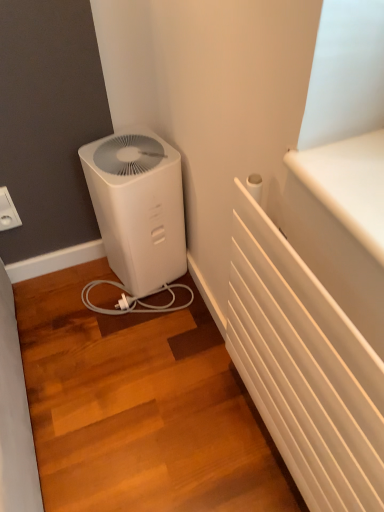
Find the location of a particular element. The height and width of the screenshot is (512, 384). white plastic air purifier at lower left is located at coordinates (138, 207).

What do you see at coordinates (138, 207) in the screenshot?
I see `white plastic air purifier at lower left` at bounding box center [138, 207].

The height and width of the screenshot is (512, 384). What are the coordinates of `white plastic electric outlet at upper left` in the screenshot? It's located at (8, 211).

Looking at this image, in order to face white plastic electric outlet at upper left, should I rotate leftwards or rightwards?

It's best to rotate left around 23.823 degrees.

Describe the element at coordinates (8, 211) in the screenshot. Image resolution: width=384 pixels, height=512 pixels. I see `white plastic electric outlet at upper left` at that location.

Locate an element on the screen. white plastic air purifier at lower left is located at coordinates (138, 207).

From the picture: Does white plastic electric outlet at upper left appear on the left side of white plastic air purifier at lower left?

Indeed, white plastic electric outlet at upper left is positioned on the left side of white plastic air purifier at lower left.

Which is in front, white plastic electric outlet at upper left or white plastic air purifier at lower left?

white plastic air purifier at lower left is closer to the camera.

Is point (11, 199) positioned in front of point (105, 223)?

Yes.

From the image's perspective, who appears lower, white plastic electric outlet at upper left or white plastic air purifier at lower left?

white plastic air purifier at lower left, from the image's perspective.

From a real-world perspective, does white plastic electric outlet at upper left sit lower than white plastic air purifier at lower left?

No, from a real-world perspective, white plastic electric outlet at upper left is not below white plastic air purifier at lower left.

Considering the relative sizes of white plastic electric outlet at upper left and white plastic air purifier at lower left in the image provided, is white plastic electric outlet at upper left wider than white plastic air purifier at lower left?

Incorrect, the width of white plastic electric outlet at upper left does not surpass that of white plastic air purifier at lower left.

Can you confirm if white plastic electric outlet at upper left is taller than white plastic air purifier at lower left?

No.

Between white plastic electric outlet at upper left and white plastic air purifier at lower left, which one has smaller size?

With smaller size is white plastic electric outlet at upper left.

In the scene shown: Is white plastic electric outlet at upper left inside the boundaries of white plastic air purifier at lower left, or outside?

white plastic electric outlet at upper left is outside white plastic air purifier at lower left.

Is white plastic electric outlet at upper left not near white plastic air purifier at lower left?

white plastic electric outlet at upper left is near white plastic air purifier at lower left, not far away.

Is white plastic electric outlet at upper left facing towards white plastic air purifier at lower left?

No, white plastic electric outlet at upper left does not turn towards white plastic air purifier at lower left.

Find the location of a particular element. The image size is (384, 512). home appliance located underneath the white plastic electric outlet at upper left (from a real-world perspective) is located at coordinates (138, 207).

Can you confirm if white plastic air purifier at lower left is positioned to the left of white plastic electric outlet at upper left?

No, white plastic air purifier at lower left is not to the left of white plastic electric outlet at upper left.

Which is behind, white plastic air purifier at lower left or white plastic electric outlet at upper left?

white plastic electric outlet at upper left is behind.

Is point (136, 261) closer to camera compared to point (3, 229)?

That is True.

From the image's perspective, between white plastic air purifier at lower left and white plastic electric outlet at upper left, which one is located above?

white plastic electric outlet at upper left is shown above in the image.

From a real-world perspective, is white plastic air purifier at lower left located higher than white plastic electric outlet at upper left?

No, from a real-world perspective, white plastic air purifier at lower left is not above white plastic electric outlet at upper left.

Based on the photo, is white plastic air purifier at lower left wider than white plastic electric outlet at upper left?

Correct, the width of white plastic air purifier at lower left exceeds that of white plastic electric outlet at upper left.

Between white plastic air purifier at lower left and white plastic electric outlet at upper left, which one has more height?

With more height is white plastic air purifier at lower left.

Can you confirm if white plastic air purifier at lower left is bigger than white plastic electric outlet at upper left?

Indeed, white plastic air purifier at lower left has a larger size compared to white plastic electric outlet at upper left.

Is white plastic electric outlet at upper left inside white plastic air purifier at lower left?

No, white plastic electric outlet at upper left is not inside white plastic air purifier at lower left.

Is white plastic air purifier at lower left far away from white plastic electric outlet at upper left?

white plastic air purifier at lower left is near white plastic electric outlet at upper left, not far away.

Could you tell me if white plastic air purifier at lower left is facing white plastic electric outlet at upper left?

No.

What's the angular difference between white plastic air purifier at lower left and white plastic electric outlet at upper left's facing directions?

12.2 degrees separate the facing orientations of white plastic air purifier at lower left and white plastic electric outlet at upper left.

Could you measure the distance between white plastic air purifier at lower left and white plastic electric outlet at upper left?

The distance of white plastic air purifier at lower left from white plastic electric outlet at upper left is 17.17 inches.

The height and width of the screenshot is (512, 384). In order to click on home appliance below the white plastic electric outlet at upper left (from the image's perspective) in this screenshot , I will do (138, 207).

Identify the location of electric outlet positioned vertically above the white plastic air purifier at lower left (from a real-world perspective). This screenshot has height=512, width=384. (8, 211).

Find the location of a particular element. Image resolution: width=384 pixels, height=512 pixels. home appliance on the right of the white plastic electric outlet at upper left is located at coordinates (138, 207).